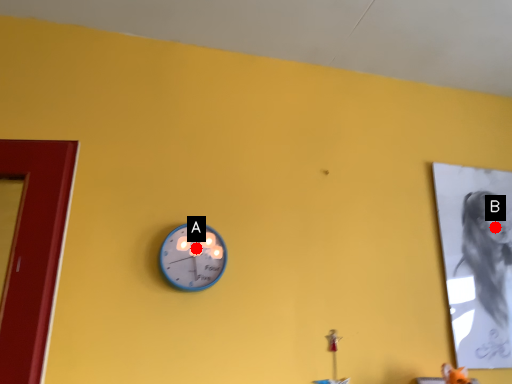
Question: Two points are circled on the image, labeled by A and B beside each circle. Which of the following is the closest to the observer?

Choices:
 (A) A is closer
 (B) B is closer

Answer: (A)